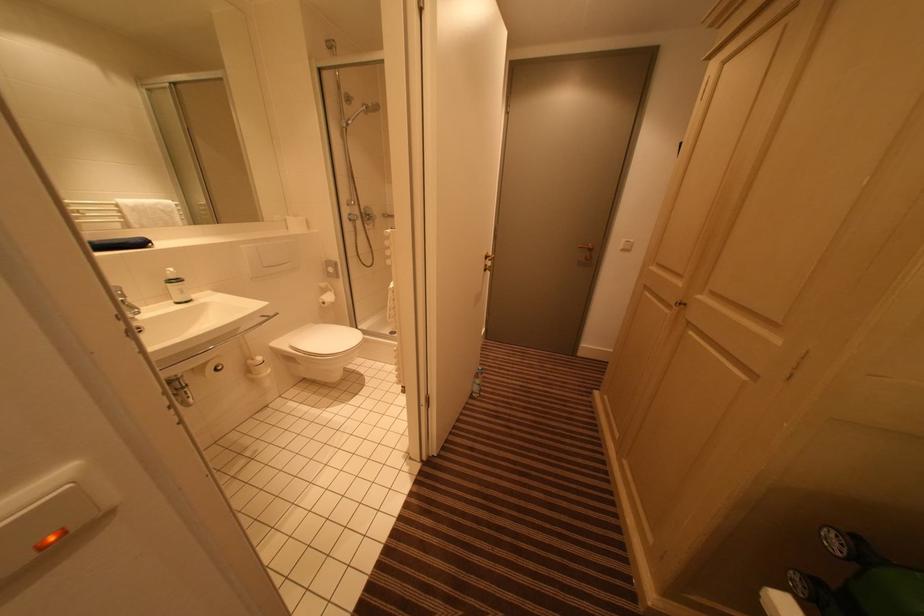
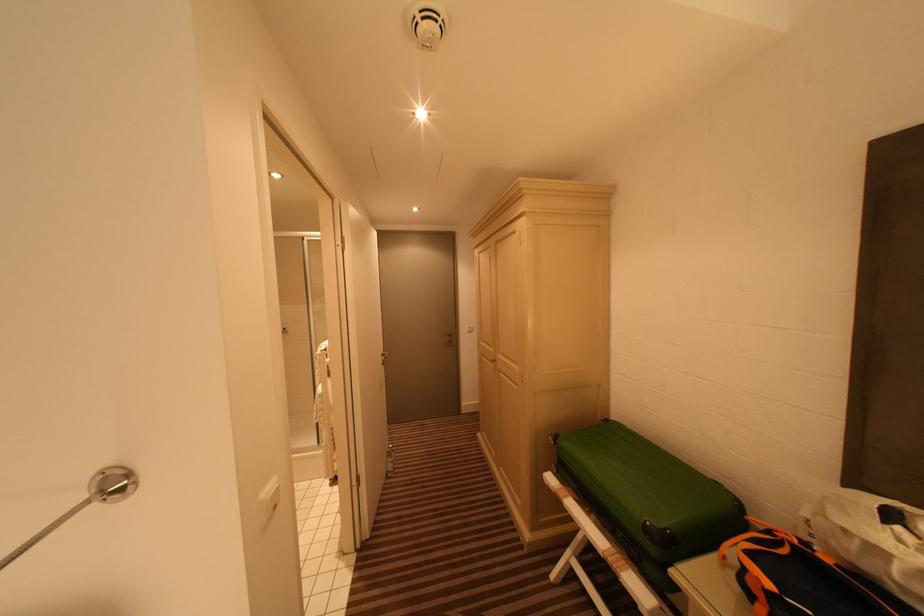
The first image is from the beginning of the video and the second image is from the end. How did the camera likely rotate when shooting the video?

The rotation direction of the camera is right-up.